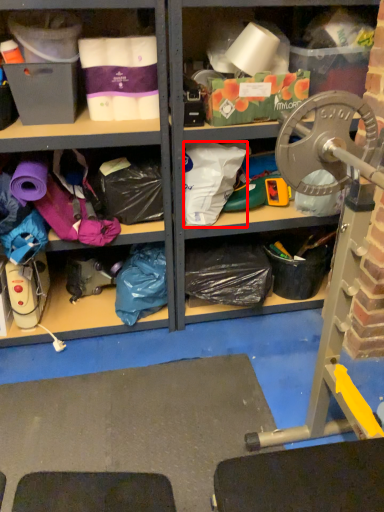
Question: From the image, what is the correct spatial relationship of clothing (annotated by the red box) in relation to clothing?

Choices:
 (A) left
 (B) right

Answer: (B)